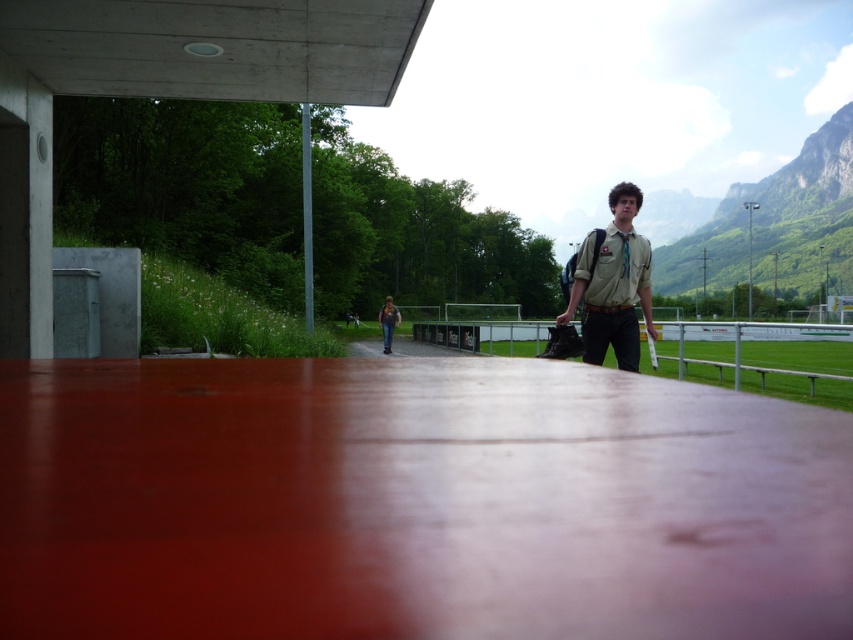
Between smooth reddish-brown surface at center and khaki fabric shirt at center, which one has less height?

smooth reddish-brown surface at center is shorter.

Does point (838, 612) come closer to viewer compared to point (625, 364)?

Yes, it is in front of point (625, 364).

Does point (602, 476) come in front of point (648, 272)?

Yes, it is in front of point (648, 272).

Where is `smooth reddish-brown surface at center`? smooth reddish-brown surface at center is located at coordinates (415, 500).

Describe the element at coordinates (798, 362) in the screenshot. I see `metallic silver rail at center` at that location.

Can you confirm if metallic silver rail at center is smaller than khaki fabric shirt at center?

No, metallic silver rail at center is not smaller than khaki fabric shirt at center.

What do you see at coordinates (798, 362) in the screenshot? The image size is (853, 640). I see `metallic silver rail at center` at bounding box center [798, 362].

You are a GUI agent. You are given a task and a screenshot of the screen. Output one action in this format:
    pyautogui.click(x=<x>, y=<y>)
    Task: Click on the metallic silver rail at center
    The height and width of the screenshot is (640, 853).
    Given the screenshot: What is the action you would take?
    pyautogui.click(x=798, y=362)

Consider the image. Who is higher up, smooth reddish-brown surface at center or metallic silver rail at center?

smooth reddish-brown surface at center is higher up.

What do you see at coordinates (415, 500) in the screenshot?
I see `smooth reddish-brown surface at center` at bounding box center [415, 500].

This screenshot has height=640, width=853. I want to click on smooth reddish-brown surface at center, so click(415, 500).